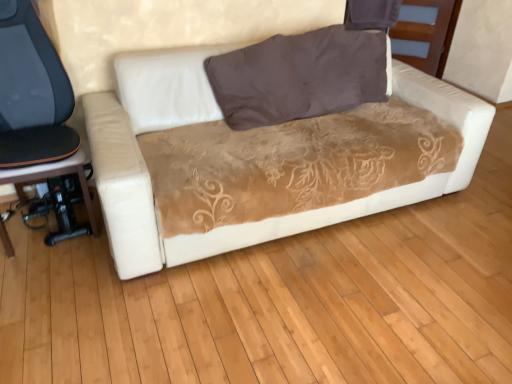
Image resolution: width=512 pixels, height=384 pixels. In order to click on vacant space in front of velvet brown couch at center in this screenshot , I will do `click(289, 325)`.